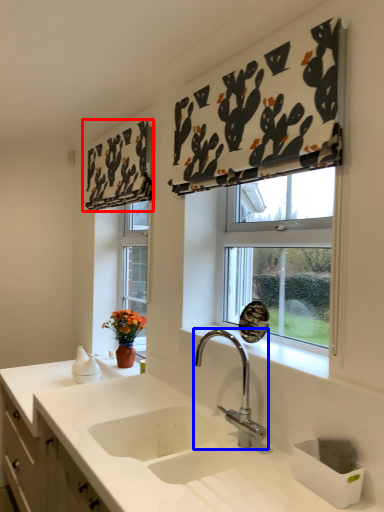
Question: Which of the following is the closest to the observer, curtain (highlighted by a red box) or tap (highlighted by a blue box)?

Choices:
 (A) curtain
 (B) tap

Answer: (B)